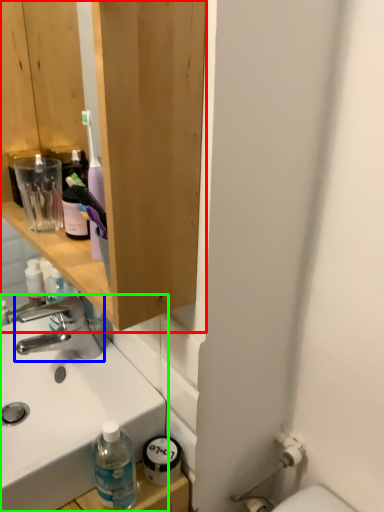
Question: Which is nearer to the bathroom cabinet (highlighted by a red box)? tap (highlighted by a blue box) or sink (highlighted by a green box).

Choices:
 (A) tap
 (B) sink

Answer: (B)